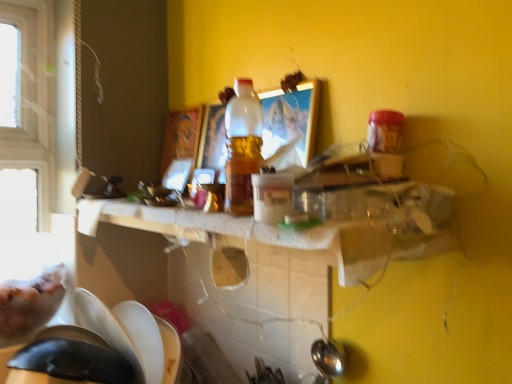
Question: In terms of height, does white paper towel at center look taller or shorter compared to translucent plastic bottle at center?

Choices:
 (A) tall
 (B) short

Answer: (B)

Question: In the image, is white paper towel at center positioned in front of or behind translucent plastic bottle at center?

Choices:
 (A) front
 (B) behind

Answer: (A)

Question: Is white paper towel at center bigger or smaller than translucent plastic bottle at center?

Choices:
 (A) big
 (B) small

Answer: (A)

Question: From the image's perspective, is translucent plastic bottle at center above or below white paper towel at center?

Choices:
 (A) above
 (B) below

Answer: (A)

Question: Is translucent plastic bottle at center bigger or smaller than white paper towel at center?

Choices:
 (A) big
 (B) small

Answer: (B)

Question: From a real-world perspective, is translucent plastic bottle at center physically located above or below white paper towel at center?

Choices:
 (A) above
 (B) below

Answer: (A)

Question: Considering the relative positions of translucent plastic bottle at center and white paper towel at center in the image provided, is translucent plastic bottle at center to the left or to the right of white paper towel at center?

Choices:
 (A) left
 (B) right

Answer: (B)